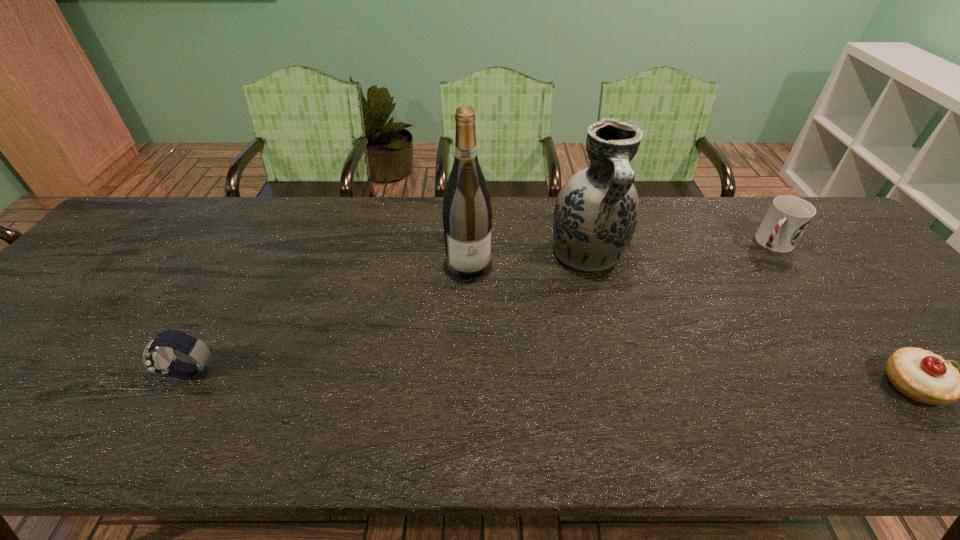
Locate an element on the screen. Image resolution: width=960 pixels, height=540 pixels. free region at the far edge of the desktop is located at coordinates (492, 223).

Where is `vacant space at the near edge of the desktop`? The width and height of the screenshot is (960, 540). vacant space at the near edge of the desktop is located at coordinates (263, 373).

Locate an element on the screen. This screenshot has width=960, height=540. vacant space at the left edge of the desktop is located at coordinates (100, 278).

What are the coordinates of `free space at the far left corner` in the screenshot? It's located at (119, 239).

Locate an element on the screen. The image size is (960, 540). vacant point located between the watch and the wine bottle is located at coordinates (330, 319).

Find the location of a particular element. The image size is (960, 540). vacant space in between the third object from left to right and the watch is located at coordinates (390, 314).

The image size is (960, 540). What are the coordinates of `unoccupied area between the cup and the vase` in the screenshot? It's located at (680, 249).

You are a GUI agent. You are given a task and a screenshot of the screen. Output one action in this format:
    pyautogui.click(x=<x>, y=<y>)
    Task: Click on the free spot between the second tallest object and the cup
    Image resolution: width=960 pixels, height=540 pixels.
    Given the screenshot: What is the action you would take?
    pyautogui.click(x=680, y=249)

Identify which object is located as the third nearest to the vase. Please provide its 2D coordinates. Your answer should be formatted as a tuple, i.e. [(x, y)], where the tuple contains the x and y coordinates of a point satisfying the conditions above.

[(922, 376)]

The height and width of the screenshot is (540, 960). I want to click on object that stands as the fourth closest to the cup, so click(x=158, y=357).